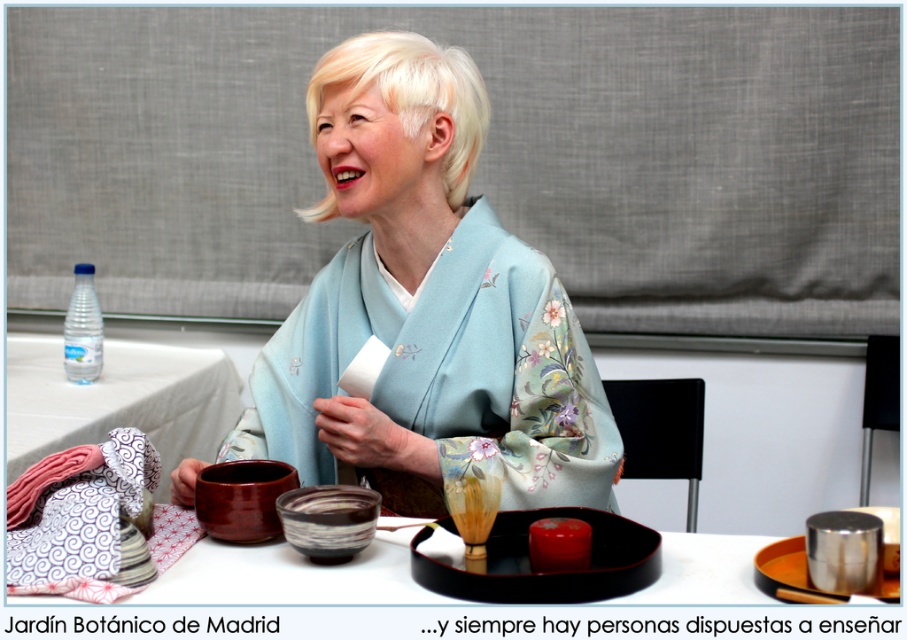
You are organizing a small event and need to place a decorative item on the table. The white fabric table at left has limited space. Can you fit the clear plastic bottle at upper left on it without overcrowding?

The white fabric table at left is wider than the clear plastic bottle at upper left, so there should be enough space to place the bottle without overcrowding.

You are organizing a cultural event and need to determine which object takes up more space. You see the light blue silk kimono at center and the clear plastic bottle at upper left. Which object requires more space?

The light blue silk kimono at center is bigger than the clear plastic bottle at upper left, so it requires more space.